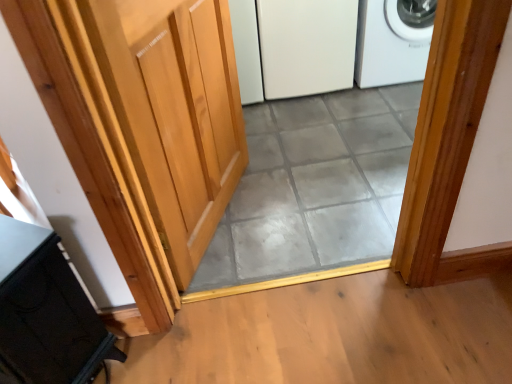
Question: Can we say gray tile at center lies outside black matte cabinet at lower left?

Choices:
 (A) yes
 (B) no

Answer: (A)

Question: Would you consider gray tile at center to be distant from black matte cabinet at lower left?

Choices:
 (A) yes
 (B) no

Answer: (B)

Question: Is gray tile at center thinner than black matte cabinet at lower left?

Choices:
 (A) no
 (B) yes

Answer: (A)

Question: Is gray tile at center further to camera compared to black matte cabinet at lower left?

Choices:
 (A) no
 (B) yes

Answer: (B)

Question: From the image's perspective, is gray tile at center located above black matte cabinet at lower left?

Choices:
 (A) yes
 (B) no

Answer: (A)

Question: In terms of height, does white plastic washing machine at upper right look taller or shorter compared to light wood door at center?

Choices:
 (A) tall
 (B) short

Answer: (B)

Question: In terms of width, does white plastic washing machine at upper right look wider or thinner when compared to light wood door at center?

Choices:
 (A) thin
 (B) wide

Answer: (B)

Question: From a real-world perspective, is white plastic washing machine at upper right above or below light wood door at center?

Choices:
 (A) below
 (B) above

Answer: (A)

Question: Is white plastic washing machine at upper right inside or outside of light wood door at center?

Choices:
 (A) outside
 (B) inside

Answer: (A)

Question: Is point (352, 238) positioned closer to the camera than point (157, 97)?

Choices:
 (A) farther
 (B) closer

Answer: (A)

Question: In terms of height, does gray tile at center look taller or shorter compared to light wood door at center?

Choices:
 (A) short
 (B) tall

Answer: (A)

Question: In terms of size, does gray tile at center appear bigger or smaller than light wood door at center?

Choices:
 (A) big
 (B) small

Answer: (B)

Question: Considering the relative positions of gray tile at center and light wood door at center in the image provided, is gray tile at center to the left or to the right of light wood door at center?

Choices:
 (A) right
 (B) left

Answer: (A)

Question: Is black matte cabinet at lower left inside or outside of gray tile at center?

Choices:
 (A) inside
 (B) outside

Answer: (B)

Question: From the image's perspective, relative to gray tile at center, is black matte cabinet at lower left above or below?

Choices:
 (A) above
 (B) below

Answer: (B)